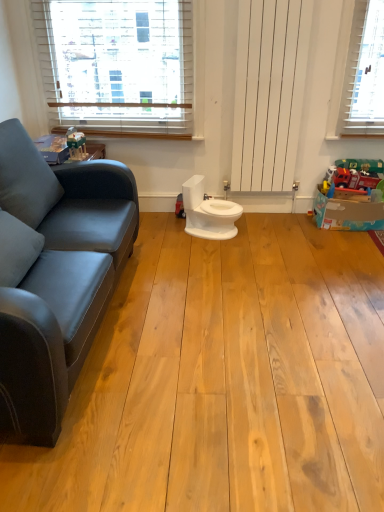
You are a GUI agent. You are given a task and a screenshot of the screen. Output one action in this format:
    pyautogui.click(x=<x>, y=<y>)
    Task: Click on the vacant point to the left of matte red fire truck at right, arranged as the 1th toy when viewed from the right
    This screenshot has height=512, width=384.
    Given the screenshot: What is the action you would take?
    pyautogui.click(x=284, y=223)